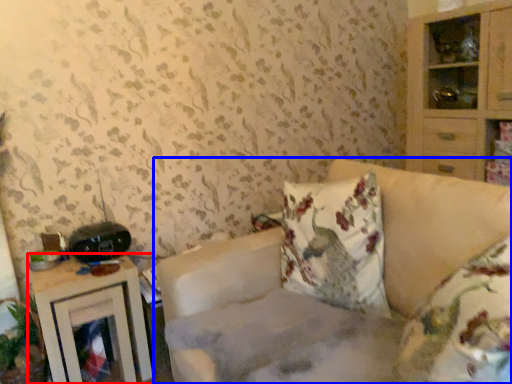
Question: Which object is further to the camera taking this photo, nightstand (highlighted by a red box) or studio couch (highlighted by a blue box)?

Choices:
 (A) nightstand
 (B) studio couch

Answer: (A)